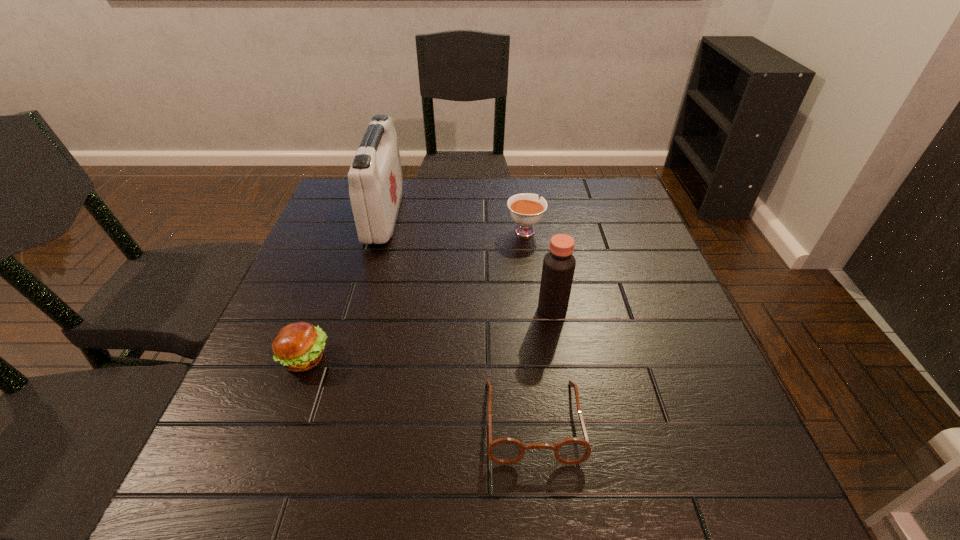
Image resolution: width=960 pixels, height=540 pixels. What are the coordinates of `free space located 0.230m on the side of the teacup with the handle` in the screenshot? It's located at (518, 177).

You are a GUI agent. You are given a task and a screenshot of the screen. Output one action in this format:
    pyautogui.click(x=<x>, y=<y>)
    Task: Click on the free spot located on the side of the teacup with the handle
    The height and width of the screenshot is (540, 960).
    Given the screenshot: What is the action you would take?
    519,187

Find the location of `free spot located 0.200m on the right of the fourth farthest object`. free spot located 0.200m on the right of the fourth farthest object is located at coordinates (428, 357).

Find the location of a particular element. the first-aid kit located at the far edge is located at coordinates (375, 178).

Locate an element on the screen. The height and width of the screenshot is (540, 960). teacup located at the far edge is located at coordinates (526, 209).

The height and width of the screenshot is (540, 960). I want to click on object located in the near edge section of the desktop, so click(x=505, y=451).

Find the location of a particular element. Image resolution: width=960 pixels, height=540 pixels. the first-aid kit present at the left edge is located at coordinates (375, 178).

Find the location of `hamburger located in the left edge section of the desktop`. hamburger located in the left edge section of the desktop is located at coordinates (299, 347).

The image size is (960, 540). I want to click on object that is at the far left corner, so click(375, 178).

The height and width of the screenshot is (540, 960). Identify the location of vacant space at the far edge of the desktop. (465, 186).